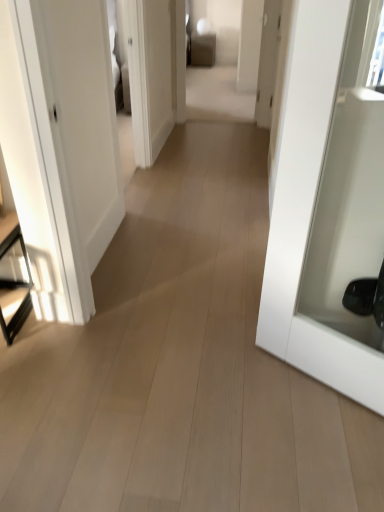
Question: Should I look upward or downward to see white glossy door at right?

Choices:
 (A) down
 (B) up

Answer: (B)

Question: Is black glass table at left facing away from white glossy door at right?

Choices:
 (A) yes
 (B) no

Answer: (B)

Question: From a real-world perspective, does black glass table at left stand above white glossy door at right?

Choices:
 (A) yes
 (B) no

Answer: (B)

Question: Does black glass table at left contain white glossy door at right?

Choices:
 (A) no
 (B) yes

Answer: (A)

Question: Is black glass table at left behind white glossy door at right?

Choices:
 (A) yes
 (B) no

Answer: (A)

Question: Is black glass table at left with white glossy door at right?

Choices:
 (A) yes
 (B) no

Answer: (B)

Question: Is black glass table at left closer to camera compared to white glossy door at right?

Choices:
 (A) yes
 (B) no

Answer: (B)

Question: Does white glossy door at right appear on the left side of black glass table at left?

Choices:
 (A) no
 (B) yes

Answer: (A)

Question: Is white glossy door at right wider than black glass table at left?

Choices:
 (A) yes
 (B) no

Answer: (B)

Question: Does white glossy door at right appear on the right side of black glass table at left?

Choices:
 (A) no
 (B) yes

Answer: (B)

Question: From the image's perspective, is white glossy door at right below black glass table at left?

Choices:
 (A) yes
 (B) no

Answer: (B)

Question: From a real-world perspective, is white glossy door at right over black glass table at left?

Choices:
 (A) no
 (B) yes

Answer: (B)

Question: Does white glossy door at right have a lesser height compared to black glass table at left?

Choices:
 (A) yes
 (B) no

Answer: (B)

Question: Is black glass table at left in front of or behind white glossy door at right in the image?

Choices:
 (A) front
 (B) behind

Answer: (B)